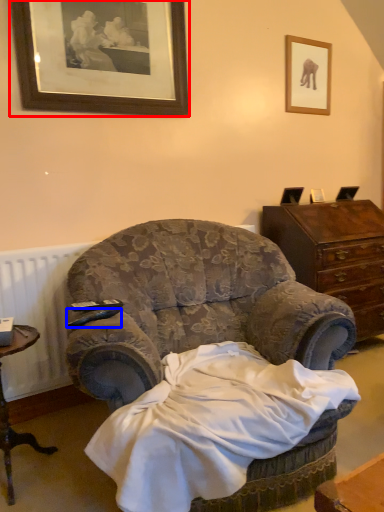
Question: Which point is further to the camera, picture frame (highlighted by a red box) or remote control (highlighted by a blue box)?

Choices:
 (A) picture frame
 (B) remote control

Answer: (A)